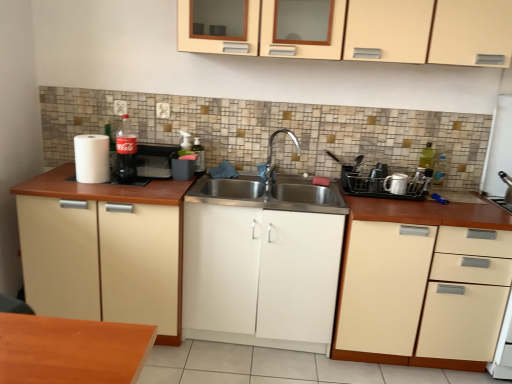
Locate an element on the screen. Image resolution: width=512 pixels, height=384 pixels. free space in front of matte glass coca-cola bottle at left, the 2th bottle positioned from the right is located at coordinates (114, 190).